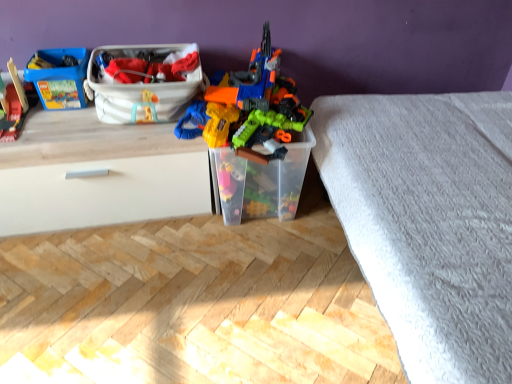
Identify the location of free spot to the right of wooden train at left, which is counted as the first toy, starting from the left. This screenshot has height=384, width=512. (59, 124).